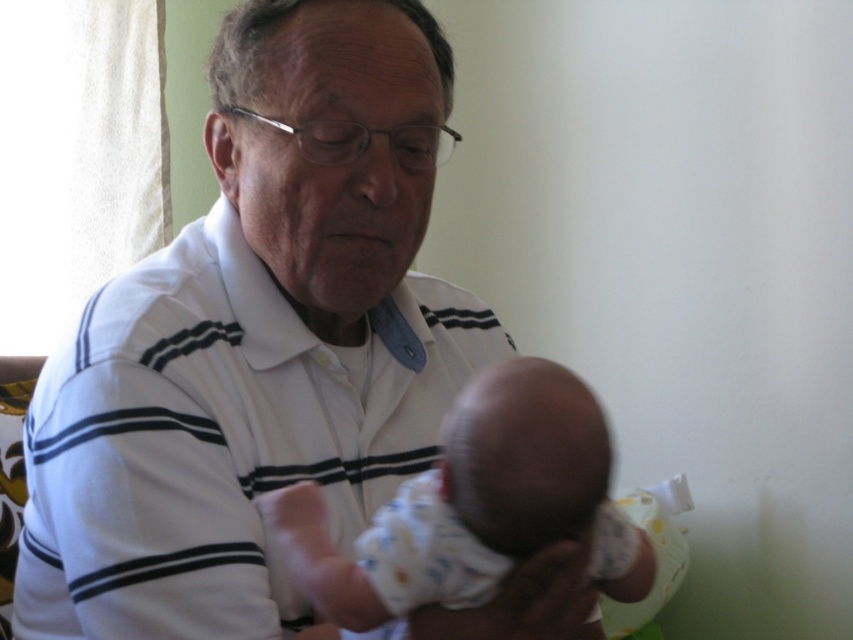
Can you confirm if white striped shirt at center is taller than white cotton baby at center?

Yes, white striped shirt at center is taller than white cotton baby at center.

Does white striped shirt at center have a smaller size compared to white cotton baby at center?

Actually, white striped shirt at center might be larger than white cotton baby at center.

Where is `white striped shirt at center`? white striped shirt at center is located at coordinates (257, 339).